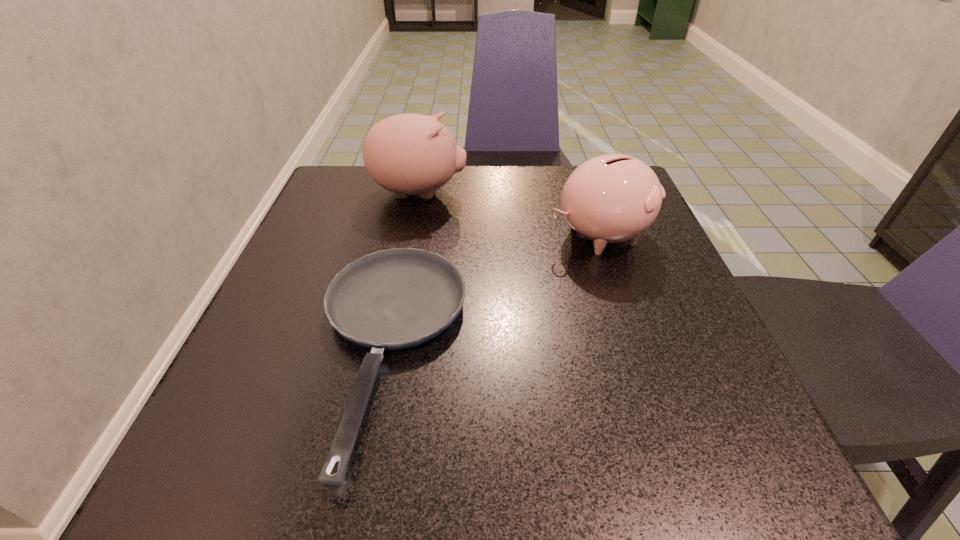
This screenshot has width=960, height=540. What are the coordinates of `free space between the left piggy bank and the rightmost object` in the screenshot? It's located at (510, 214).

Image resolution: width=960 pixels, height=540 pixels. What are the coordinates of `vacant area that lies between the left piggy bank and the right piggy bank` in the screenshot? It's located at (510, 214).

Find the location of a particular element. The width and height of the screenshot is (960, 540). free space between the frying pan and the rightmost object is located at coordinates (494, 293).

The image size is (960, 540). I want to click on free space between the frying pan and the rightmost object, so click(x=494, y=293).

Where is `vacant area that lies between the shortest object and the right piggy bank`? Image resolution: width=960 pixels, height=540 pixels. vacant area that lies between the shortest object and the right piggy bank is located at coordinates (494, 293).

Identify the location of free space between the right piggy bank and the left piggy bank. The image size is (960, 540). (510, 214).

Locate an element on the screen. the closest object to the left piggy bank is located at coordinates (392, 299).

Identify the location of object that is the closest to the rightmost object. This screenshot has width=960, height=540. (392, 299).

In order to click on free space that satisfies the following two spatial constraints: 1. at the snout of the left piggy bank; 2. on the left side of the rightmost object in this screenshot , I will do `click(411, 235)`.

In order to click on free space in the image that satisfies the following two spatial constraints: 1. at the snout of the left piggy bank; 2. on the back side of the frying pan in this screenshot , I will do `click(388, 351)`.